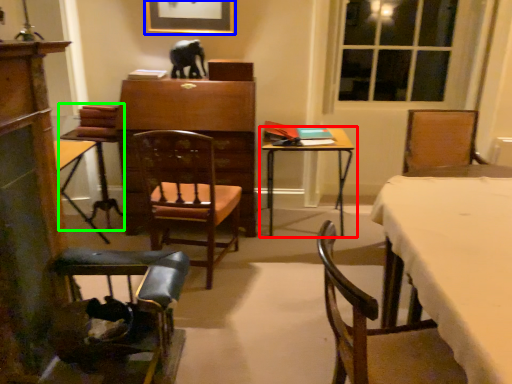
Question: Which object is the farthest from table (highlighted by a red box)? Choose among these: picture frame (highlighted by a blue box) or armchair (highlighted by a green box).

Choices:
 (A) picture frame
 (B) armchair

Answer: (B)